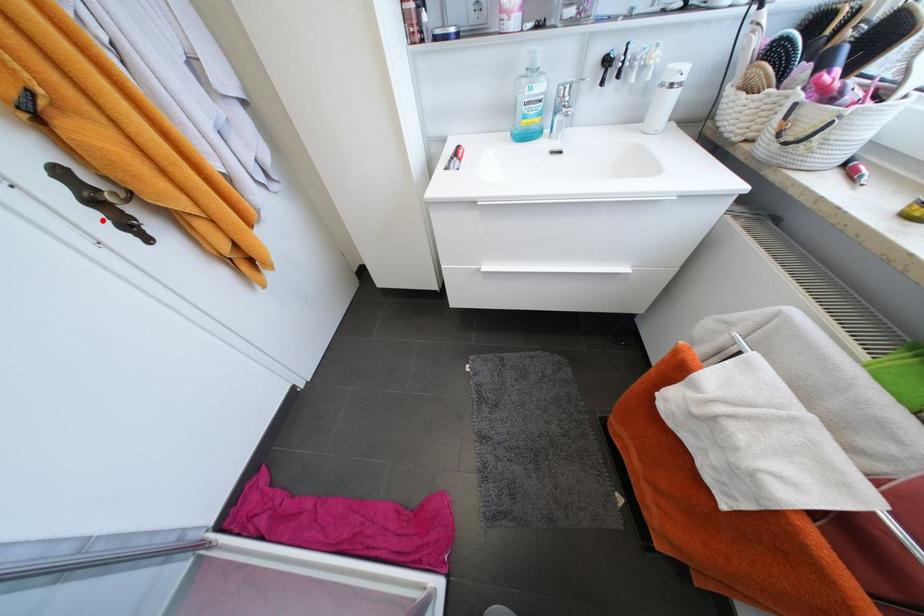
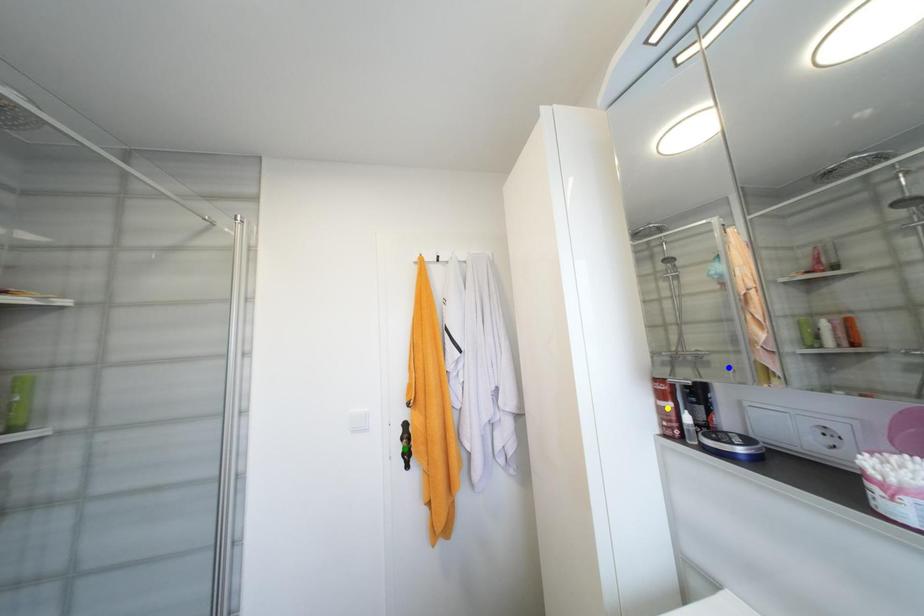
Question: I am providing you with two images of the same scene from different viewpoints. A red point is marked on the first image. You are given multiple points on the second image. Which point in image 2 represents the same 3d spot as the red point in image 1?

Choices:
 (A) green point
 (B) blue point
 (C) yellow point

Answer: (A)